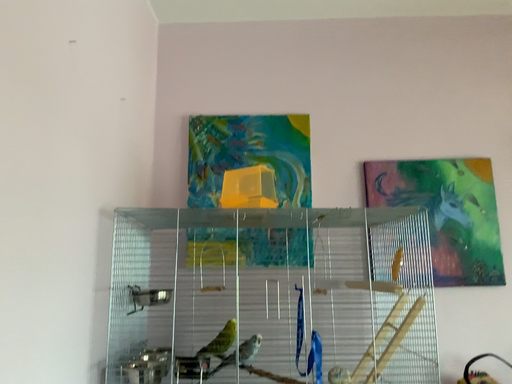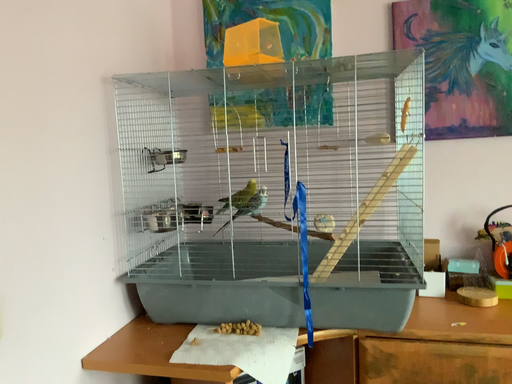
Question: How did the camera likely rotate when shooting the video?

Choices:
 (A) rotated right
 (B) rotated left

Answer: (B)